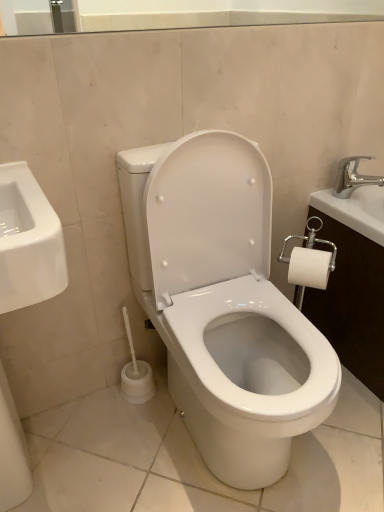
Question: Relative to silver metallic faucet at upper right, is white glossy toilet at center in front or behind?

Choices:
 (A) behind
 (B) front

Answer: (B)

Question: Is white glossy toilet at center wider or thinner than silver metallic faucet at upper right?

Choices:
 (A) wide
 (B) thin

Answer: (A)

Question: Would you say white glossy toilet at center is inside or outside silver metallic faucet at upper right?

Choices:
 (A) outside
 (B) inside

Answer: (A)

Question: From the image's perspective, is silver metallic faucet at upper right positioned above or below white glossy toilet at center?

Choices:
 (A) below
 (B) above

Answer: (B)

Question: Is silver metallic faucet at upper right in front of or behind white glossy toilet at center in the image?

Choices:
 (A) front
 (B) behind

Answer: (B)

Question: Is silver metallic faucet at upper right taller or shorter than white glossy toilet at center?

Choices:
 (A) short
 (B) tall

Answer: (A)

Question: Looking at the image, does silver metallic faucet at upper right seem bigger or smaller compared to white glossy toilet at center?

Choices:
 (A) small
 (B) big

Answer: (A)